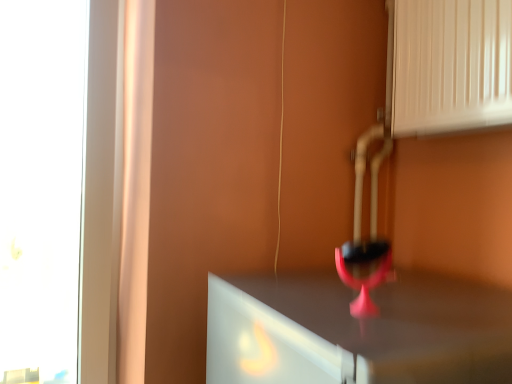
Question: Can you confirm if white glossy vent at upper right is shorter than pink matte wine glass at center?

Choices:
 (A) yes
 (B) no

Answer: (B)

Question: Is white glossy vent at upper right taller than pink matte wine glass at center?

Choices:
 (A) no
 (B) yes

Answer: (B)

Question: Is white glossy vent at upper right in front of pink matte wine glass at center?

Choices:
 (A) no
 (B) yes

Answer: (A)

Question: From a real-world perspective, is white glossy vent at upper right over pink matte wine glass at center?

Choices:
 (A) no
 (B) yes

Answer: (B)

Question: Is white glossy vent at upper right directly adjacent to pink matte wine glass at center?

Choices:
 (A) no
 (B) yes

Answer: (A)

Question: Is there a large distance between white glossy vent at upper right and pink matte wine glass at center?

Choices:
 (A) yes
 (B) no

Answer: (B)

Question: Does pink matte wine glass at center have a greater height compared to white glossy vent at upper right?

Choices:
 (A) no
 (B) yes

Answer: (A)

Question: Is pink matte wine glass at center placed right next to white glossy vent at upper right?

Choices:
 (A) yes
 (B) no

Answer: (B)

Question: Is pink matte wine glass at center not inside white glossy vent at upper right?

Choices:
 (A) yes
 (B) no

Answer: (A)

Question: Does pink matte wine glass at center lie behind white glossy vent at upper right?

Choices:
 (A) yes
 (B) no

Answer: (B)

Question: From a real-world perspective, is pink matte wine glass at center located higher than white glossy vent at upper right?

Choices:
 (A) yes
 (B) no

Answer: (B)

Question: Could you tell me if pink matte wine glass at center is facing white glossy vent at upper right?

Choices:
 (A) yes
 (B) no

Answer: (B)

Question: From a real-world perspective, is white glossy vent at upper right above or below pink matte wine glass at center?

Choices:
 (A) below
 (B) above

Answer: (B)